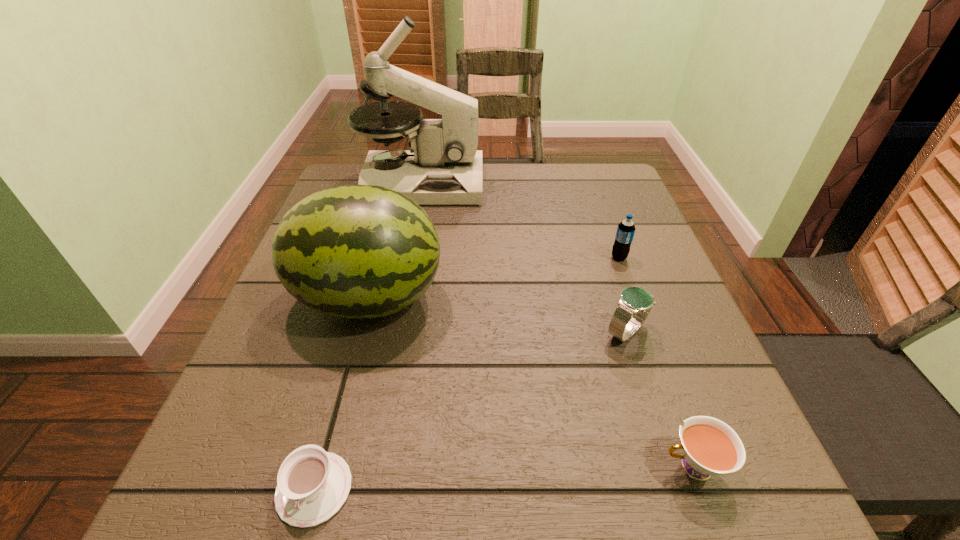
Where is `object that is the fourth closest to the second tallest object`? The width and height of the screenshot is (960, 540). object that is the fourth closest to the second tallest object is located at coordinates (625, 232).

This screenshot has width=960, height=540. I want to click on object that is the third closest to the third shortest object, so click(x=354, y=251).

You are a GUI agent. You are given a task and a screenshot of the screen. Output one action in this format:
    pyautogui.click(x=<x>, y=<y>)
    Task: Click on the vacant region that satisfies the following two spatial constraints: 1. on the side of the second shortest object with the handle; 2. on the handle side of the shorter teacup
    
    Given the screenshot: What is the action you would take?
    pyautogui.click(x=700, y=489)

Where is `blank area in the image that satisfies the following two spatial constraints: 1. at the eyepiece of the microscope; 2. on the left side of the fourth shortest object`? The image size is (960, 540). blank area in the image that satisfies the following two spatial constraints: 1. at the eyepiece of the microscope; 2. on the left side of the fourth shortest object is located at coordinates (408, 258).

Find the location of a particular element. This screenshot has height=540, width=960. blank space that satisfies the following two spatial constraints: 1. at the stem end of the watermelon; 2. on the handle side of the left teacup is located at coordinates (320, 489).